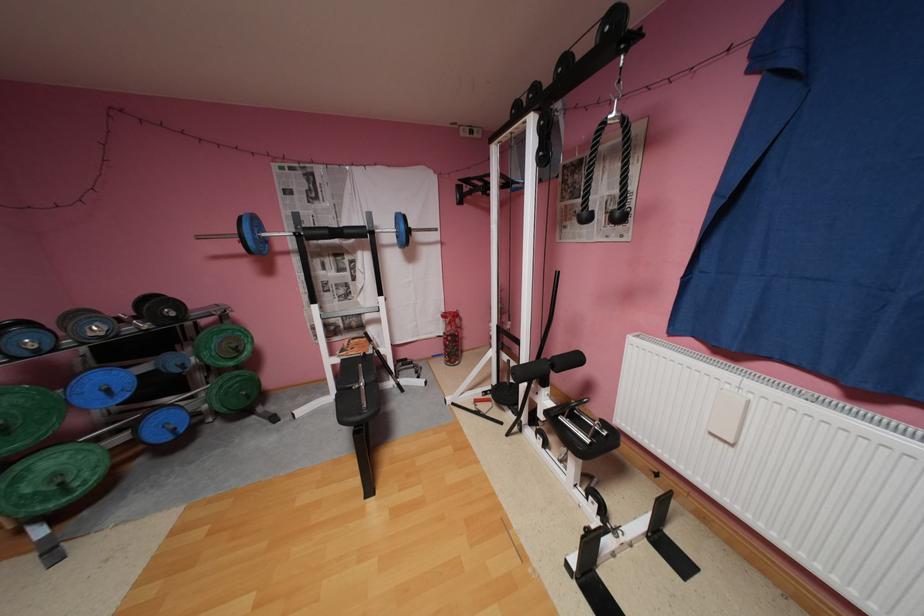
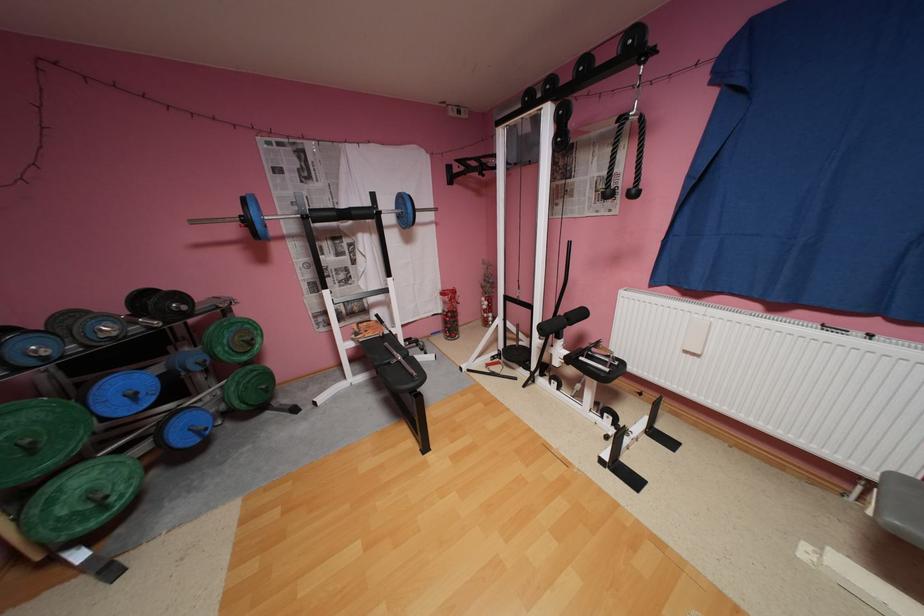
Find the pixel in the second image that matches pixel 355 231 in the first image.

(362, 213)